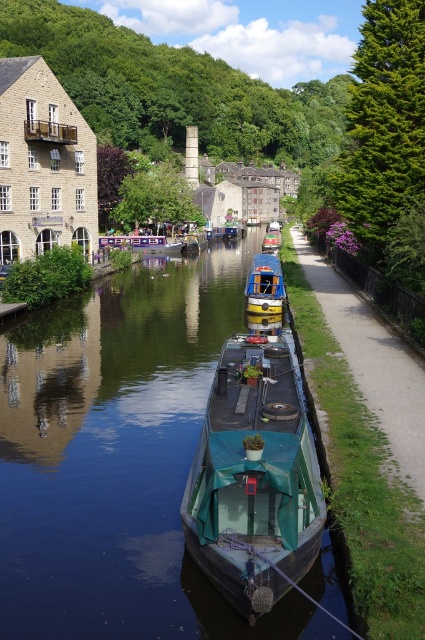
You are a tourist standing on the left side of the canal and want to take a photo of both the teal canvas boat at center and the teal fabric boat at center. Which boat should you position yourself closer to in order to capture both in the frame?

You should position yourself closer to the teal canvas boat at center because it is on the left side of the teal fabric boat at center, so moving closer to the left boat will help include both in the frame.

You are standing on the historic stone building on the left side of the canal. You see two boats in the center of the canal, a green canvas boat at center and a teal fabric boat at center. Which boat is closer to you?

The green canvas boat at center is closer to you because it is in front of the teal fabric boat at center.